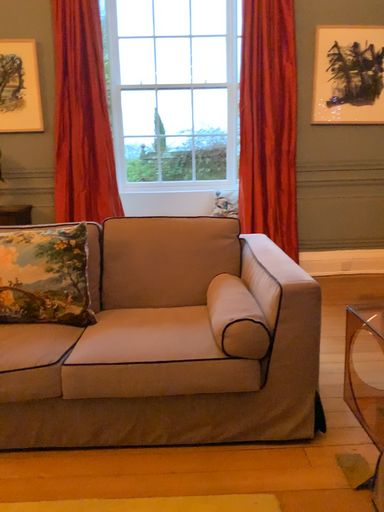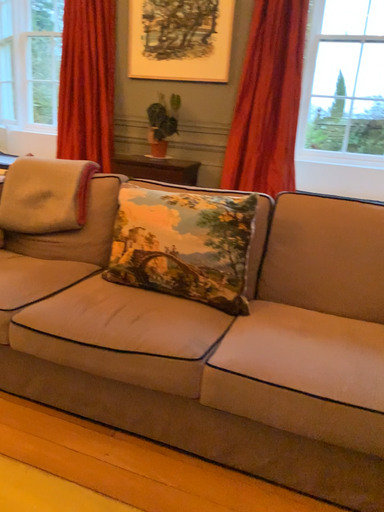
Question: Which way did the camera rotate in the video?

Choices:
 (A) rotated right
 (B) rotated left

Answer: (B)